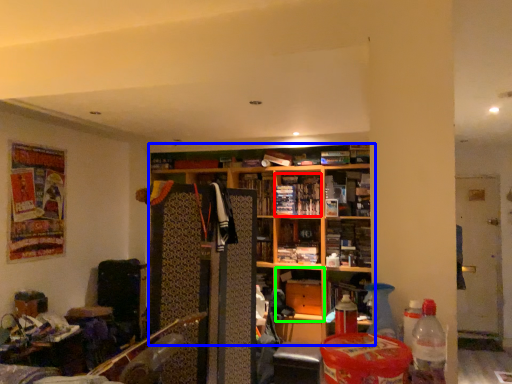
Question: Considering the real-world distances, which object is farthest from book (highlighted by a red box)? shelf (highlighted by a blue box) or cabinet (highlighted by a green box)?

Choices:
 (A) shelf
 (B) cabinet

Answer: (B)